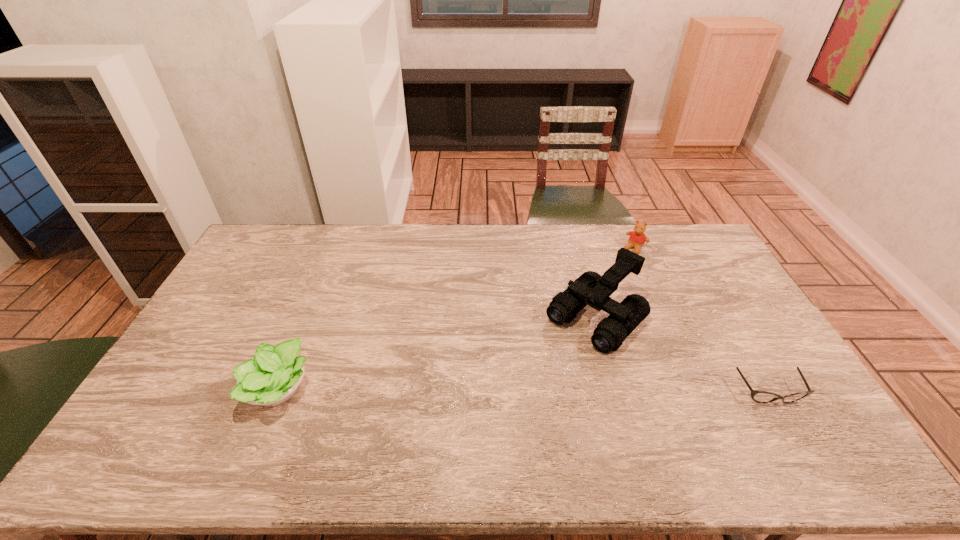
Identify the location of lettuce. The height and width of the screenshot is (540, 960). (272, 377).

Where is `spectacles`? This screenshot has width=960, height=540. spectacles is located at coordinates (758, 396).

Identify the location of the rightmost object. The image size is (960, 540). point(758,396).

Find the location of a particular element. This screenshot has width=960, height=540. teddy bear is located at coordinates (637, 238).

The image size is (960, 540). I want to click on the farthest object, so click(x=637, y=238).

You are a GUI agent. You are given a task and a screenshot of the screen. Output one action in this format:
    pyautogui.click(x=<x>, y=<y>)
    Task: Click on the third object from right to left
    Image resolution: width=960 pixels, height=540 pixels.
    Given the screenshot: What is the action you would take?
    pyautogui.click(x=592, y=289)

This screenshot has width=960, height=540. I want to click on the tallest object, so click(592, 289).

Find the location of a particular element. Image resolution: width=960 pixels, height=540 pixels. vacant space located 0.340m on the back of the lettuce is located at coordinates (323, 282).

The height and width of the screenshot is (540, 960). I want to click on vacant space situated on the front-facing side of the shortest object, so click(786, 424).

Image resolution: width=960 pixels, height=540 pixels. Find the location of `vacant space located 0.180m on the front-facing side of the second object from right to left`. vacant space located 0.180m on the front-facing side of the second object from right to left is located at coordinates (612, 279).